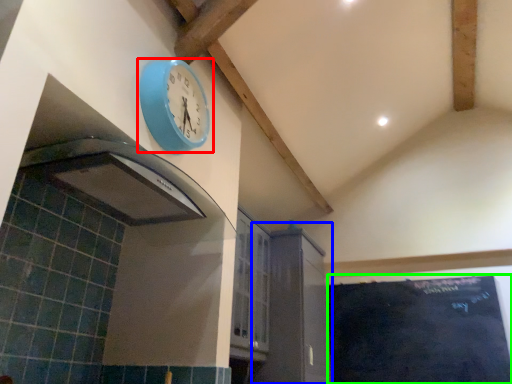
Question: Which is nearer to the wall clock (highlighted by a red box)? cabinetry (highlighted by a blue box) or bulletin board (highlighted by a green box).

Choices:
 (A) cabinetry
 (B) bulletin board

Answer: (A)